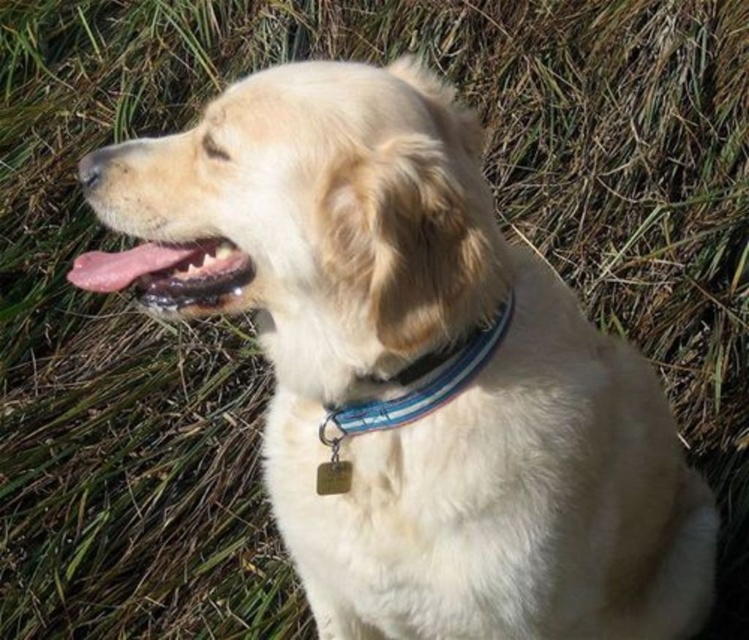
Between pink glossy tongue at center and blue fabric collar at center, which one is positioned lower?

blue fabric collar at center is lower down.

Which is behind, point (240, 273) or point (366, 403)?

The point (366, 403) is behind.

What do you see at coordinates (166, 273) in the screenshot?
I see `pink glossy tongue at center` at bounding box center [166, 273].

This screenshot has width=749, height=640. Find the location of `pink glossy tongue at center`. pink glossy tongue at center is located at coordinates coord(166,273).